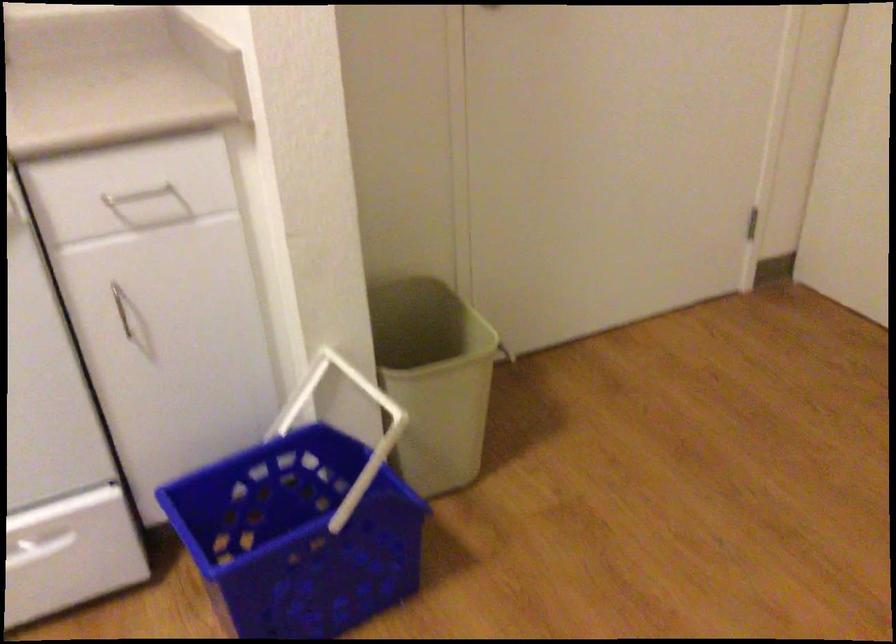
Find where to pull the white basket handle. Please return your answer as a coordinate pair (x, y).

(343, 402)